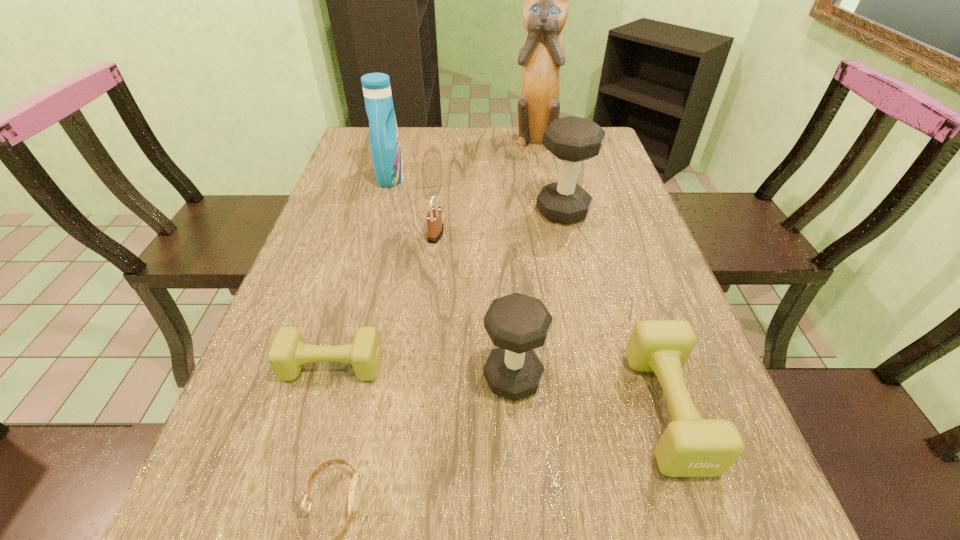
This screenshot has width=960, height=540. What are the coordinates of `the right olive dumbbell` in the screenshot? It's located at (690, 446).

This screenshot has height=540, width=960. I want to click on the second shortest object, so click(288, 353).

Where is `the left olive dumbbell`? Image resolution: width=960 pixels, height=540 pixels. the left olive dumbbell is located at coordinates (288, 353).

This screenshot has width=960, height=540. In order to click on blank space located 0.120m on the face of the farthest object in this screenshot , I will do 540,171.

You are a GUI agent. You are given a task and a screenshot of the screen. Output one action in this format:
    pyautogui.click(x=<x>, y=<y>)
    Task: Click on the free point located on the front-facing side of the second farthest object
    This screenshot has width=960, height=540.
    Given the screenshot: What is the action you would take?
    pyautogui.click(x=441, y=178)

You are a GUI agent. You are given a task and a screenshot of the screen. Output one action in this format:
    pyautogui.click(x=<x>, y=<y>)
    Task: Click on the vacant space situated 0.140m on the left of the farthest dumbbell
    
    Given the screenshot: What is the action you would take?
    pyautogui.click(x=484, y=211)

You are a GUI agent. You are given a task and a screenshot of the screen. Output one action in this format:
    pyautogui.click(x=<x>, y=<y>)
    Task: Click on the vacant space situated 0.330m on the left of the fourth tallest object
    The height and width of the screenshot is (540, 960).
    Given the screenshot: What is the action you would take?
    pyautogui.click(x=304, y=378)

Where is `blank area located 0.150m on the front of the padlock`? blank area located 0.150m on the front of the padlock is located at coordinates (430, 287).

At what (x,y) coordinates should I click in order to perform the action: click on vacant space located on the back of the right olive dumbbell. Please return your answer as a coordinate pair (x, y). This screenshot has height=540, width=960. Looking at the image, I should click on (615, 254).

Find the location of a particular element. This screenshot has width=960, height=540. vacant region located 0.180m on the back of the shortest dumbbell is located at coordinates (356, 285).